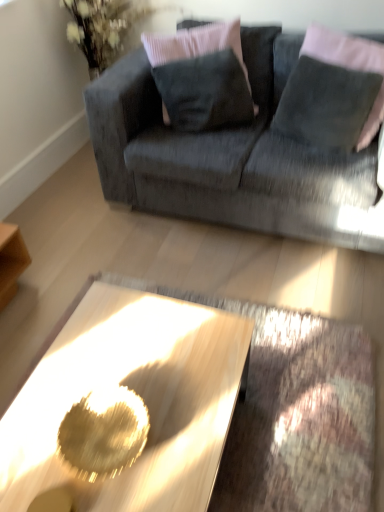
Identify the location of vacant area on top of metallic gold coffee table at center (from a real-world perspective). The height and width of the screenshot is (512, 384). (124, 391).